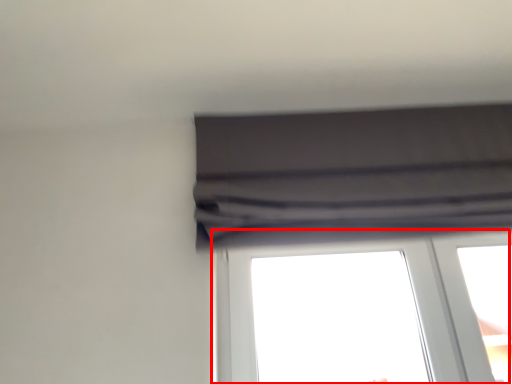
Question: Where is window (annotated by the red box) located in relation to curtain in the image?

Choices:
 (A) left
 (B) right

Answer: (A)